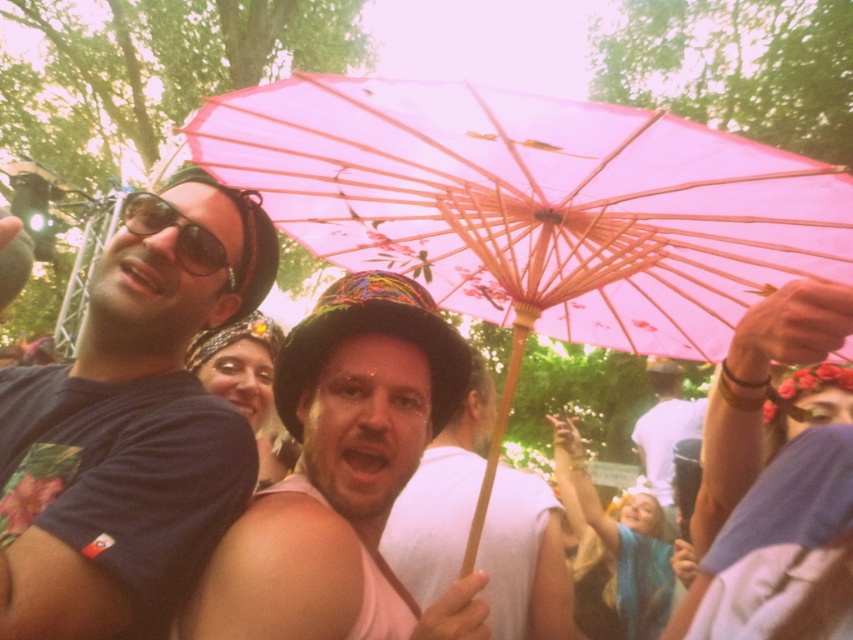
You are a photographer trying to capture the best shot of the festival scene. You notice two points in the image at coordinates point (106, 296) and point (527, 600). Which point should you focus on to ensure it appears clearer in your photo?

Point (106, 296) is closer to the camera than point (527, 600), so focusing on point (106, 296) will ensure it appears clearer in the photo.

Based on the photo, you are a photographer trying to capture the perfect shot of the matte black hat at center. What are the exact coordinates where you should aim your camera?

The exact coordinates for the matte black hat at center are at point (343, 472).

You are a photographer trying to capture a clear shot of the matte black hat at center and the matte black goggles at upper left. Since you want to focus on the taller object, which one should you adjust your camera to focus on?

The matte black hat at center is taller than the matte black goggles at upper left, so you should adjust your camera to focus on the matte black hat at center.